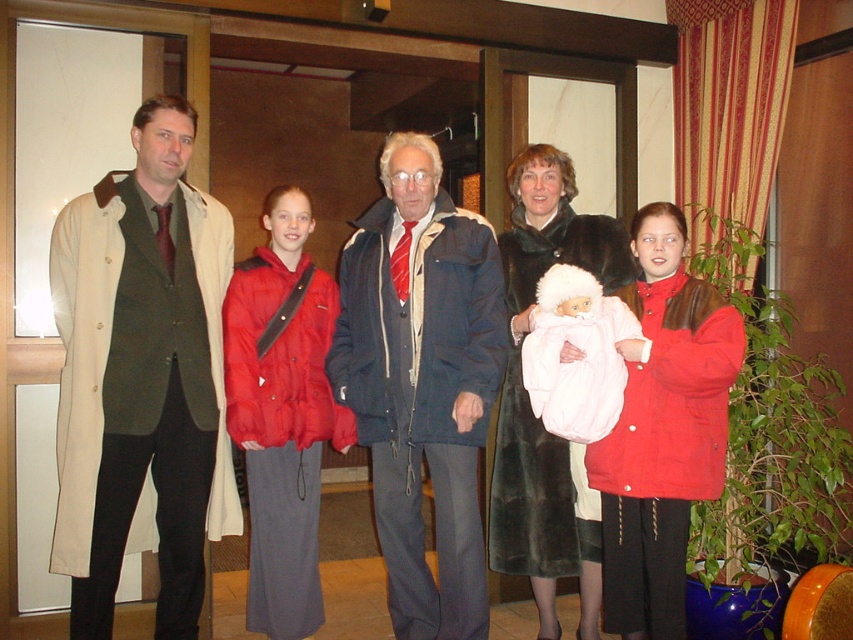
Is matte beige coat at left below matte pink fabric baby at center?

Incorrect, matte beige coat at left is not positioned below matte pink fabric baby at center.

Who is higher up, matte beige coat at left or matte pink fabric baby at center?

matte beige coat at left

Consider the image. Who is more distant from viewer, (163, 602) or (236, 292)?

The point (236, 292) is more distant.

This screenshot has height=640, width=853. What are the coordinates of `matte beige coat at left` in the screenshot? It's located at (141, 376).

Can you confirm if matte beige coat at left is thinner than dark blue textured jacket at center?

Yes, matte beige coat at left is thinner than dark blue textured jacket at center.

Does matte beige coat at left appear under dark blue textured jacket at center?

Incorrect, matte beige coat at left is not positioned below dark blue textured jacket at center.

Does point (140, 244) come farther from viewer compared to point (461, 364)?

No.

You are a GUI agent. You are given a task and a screenshot of the screen. Output one action in this format:
    pyautogui.click(x=<x>, y=<y>)
    Task: Click on the matte beige coat at left
    This screenshot has height=640, width=853.
    Given the screenshot: What is the action you would take?
    pyautogui.click(x=141, y=376)

Between matte black coat at center and dark blue textured jacket at center, which one has less height?

dark blue textured jacket at center is shorter.

Which of these two, matte black coat at center or dark blue textured jacket at center, stands taller?

With more height is matte black coat at center.

Which is in front, point (80, 305) or point (494, 340)?

Point (80, 305) is more forward.

You are a GUI agent. You are given a task and a screenshot of the screen. Output one action in this format:
    pyautogui.click(x=<x>, y=<y>)
    Task: Click on the matte black coat at center
    The width and height of the screenshot is (853, 640).
    Given the screenshot: What is the action you would take?
    pyautogui.click(x=143, y=376)